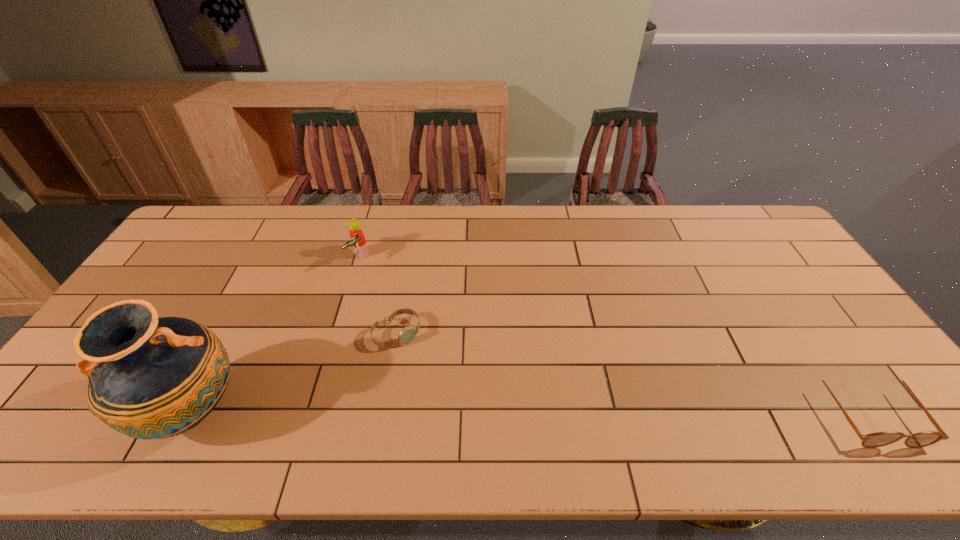
Image resolution: width=960 pixels, height=540 pixels. In order to click on the leftmost object in this screenshot , I will do `click(150, 378)`.

The image size is (960, 540). I want to click on pottery, so click(x=150, y=378).

Find the location of a particular element. The width and height of the screenshot is (960, 540). sunglasses is located at coordinates (878, 439).

Identify the location of the farthest object. (357, 238).

You are a GUI agent. You are given a task and a screenshot of the screen. Output one action in this format:
    pyautogui.click(x=<x>, y=<y>)
    Task: Click on the second tallest object
    This screenshot has width=960, height=540.
    Given the screenshot: What is the action you would take?
    pyautogui.click(x=357, y=238)

The width and height of the screenshot is (960, 540). Identify the location of the third nearest object. click(x=408, y=333).

Find the location of a particular element. the third object from left to right is located at coordinates (408, 333).

Find the location of a particular element. Image resolution: width=960 pixels, height=540 pixels. vacant space located 0.130m on the left of the pottery is located at coordinates (84, 411).

This screenshot has width=960, height=540. Identify the location of blank space located in front of the Lego with the accessory visible. (437, 330).

Where is `vacant space located in front of the Lego with the accessory visible`? This screenshot has width=960, height=540. vacant space located in front of the Lego with the accessory visible is located at coordinates (408, 306).